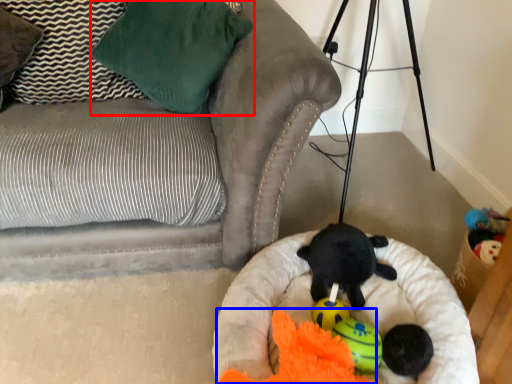
Question: Among these objects, which one is nearest to the camera, pillow (highlighted by a red box) or toy (highlighted by a blue box)?

Choices:
 (A) pillow
 (B) toy

Answer: (B)